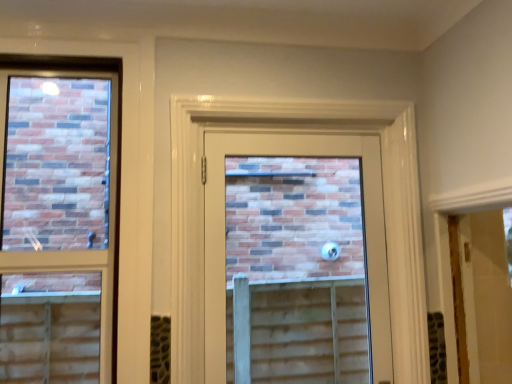
Question: Should I look upward or downward to see matte glass door at center?

Choices:
 (A) up
 (B) down

Answer: (B)

Question: Does matte glass window at left come behind matte glass door at center?

Choices:
 (A) no
 (B) yes

Answer: (A)

Question: Can you confirm if matte glass window at left is positioned to the left of matte glass door at center?

Choices:
 (A) no
 (B) yes

Answer: (B)

Question: From the image's perspective, does matte glass window at left appear higher than matte glass door at center?

Choices:
 (A) yes
 (B) no

Answer: (A)

Question: Is matte glass window at left not within matte glass door at center?

Choices:
 (A) yes
 (B) no

Answer: (A)

Question: Is matte glass window at left closer to camera compared to matte glass door at center?

Choices:
 (A) no
 (B) yes

Answer: (B)

Question: Does matte glass window at left have a greater width compared to matte glass door at center?

Choices:
 (A) yes
 (B) no

Answer: (A)

Question: Considering the relative sizes of matte glass door at center and matte glass window at left in the image provided, is matte glass door at center smaller than matte glass window at left?

Choices:
 (A) yes
 (B) no

Answer: (B)

Question: Considering the relative sizes of matte glass door at center and matte glass window at left in the image provided, is matte glass door at center taller than matte glass window at left?

Choices:
 (A) no
 (B) yes

Answer: (A)

Question: Would you say matte glass window at left is part of matte glass door at center's contents?

Choices:
 (A) yes
 (B) no

Answer: (B)

Question: Does matte glass door at center lie behind matte glass window at left?

Choices:
 (A) no
 (B) yes

Answer: (B)

Question: Is matte glass door at center oriented towards matte glass window at left?

Choices:
 (A) yes
 (B) no

Answer: (B)

Question: From the image's perspective, is matte glass door at center located above matte glass window at left?

Choices:
 (A) no
 (B) yes

Answer: (A)

Question: Considering the positions of matte glass door at center and matte glass window at left in the image, is matte glass door at center wider or thinner than matte glass window at left?

Choices:
 (A) wide
 (B) thin

Answer: (B)